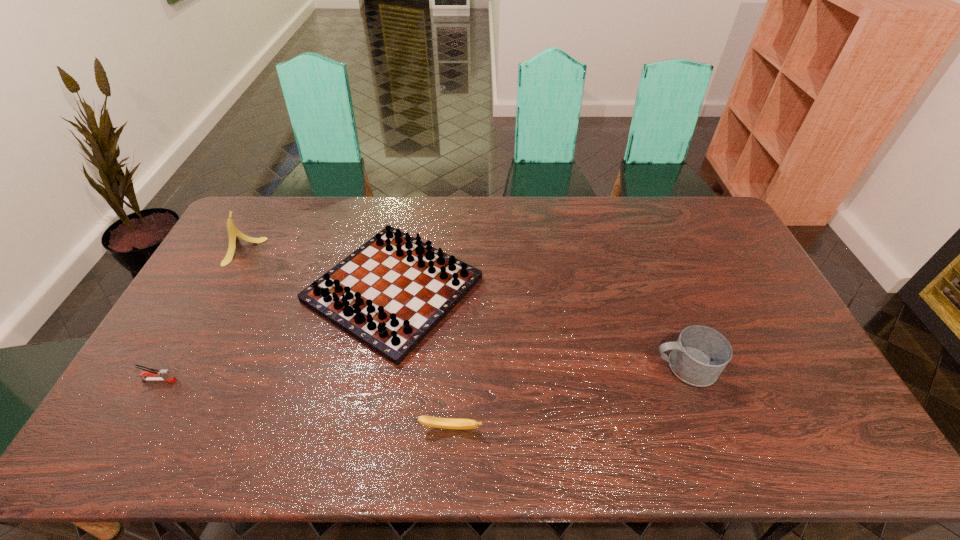
Where is `vacant space that is in between the rightmost object and the taller banana`? Image resolution: width=960 pixels, height=540 pixels. vacant space that is in between the rightmost object and the taller banana is located at coordinates (463, 308).

Locate an element on the screen. free space between the mug and the shortest object is located at coordinates (567, 397).

You are a GUI agent. You are given a task and a screenshot of the screen. Output one action in this format:
    pyautogui.click(x=<x>, y=<y>)
    Task: Click on the free space between the second shortest object and the farther banana
    The image size is (960, 540).
    Given the screenshot: What is the action you would take?
    pyautogui.click(x=201, y=315)

Image resolution: width=960 pixels, height=540 pixels. I want to click on empty location between the chessboard and the mug, so click(539, 328).

What are the coordinates of `object that can be found as the second closest to the chessboard` in the screenshot? It's located at (233, 233).

Identify which object is located as the nearest to the right banana. Please provide its 2D coordinates. Your answer should be formatted as a tuple, i.e. [(x, y)], where the tuple contains the x and y coordinates of a point satisfying the conditions above.

[(389, 294)]